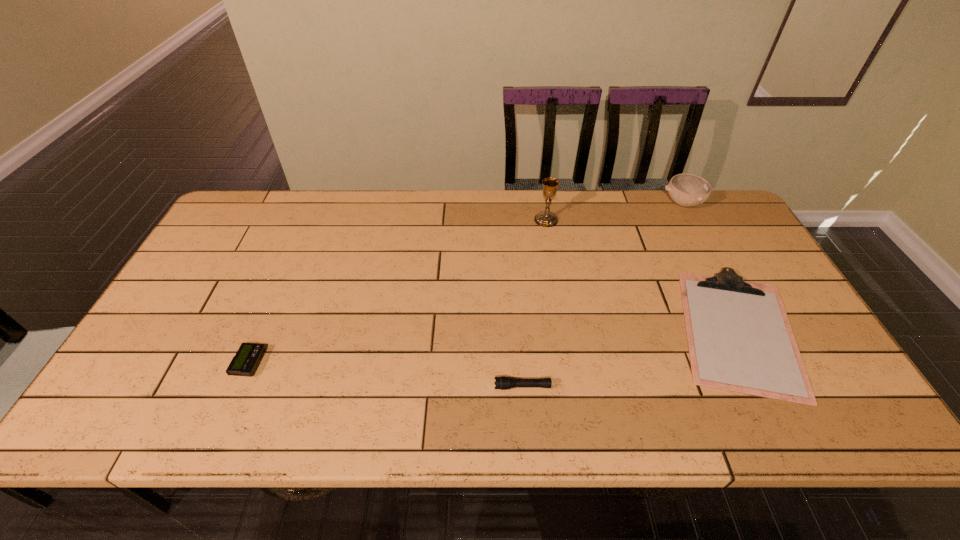
You are a GUI agent. You are given a task and a screenshot of the screen. Output one action in this format:
    pyautogui.click(x=<x>, y=<y>)
    Task: Click on the tallest object
    The height and width of the screenshot is (540, 960).
    Given the screenshot: What is the action you would take?
    pyautogui.click(x=546, y=218)

Identify the location of the third object from right to left. This screenshot has height=540, width=960. (546, 218).

Image resolution: width=960 pixels, height=540 pixels. What are the coordinates of `the second tallest object` in the screenshot? It's located at [687, 190].

The width and height of the screenshot is (960, 540). Identify the location of flashlight. (503, 382).

You are a GUI agent. You are given a task and a screenshot of the screen. Output one action in this format:
    pyautogui.click(x=<x>, y=<y>)
    Task: Click on the fourth object from right to left
    
    Given the screenshot: What is the action you would take?
    pyautogui.click(x=503, y=382)

Locate an element on the screen. beeper is located at coordinates (244, 363).

You are a GUI agent. You are given a task and a screenshot of the screen. Output one action in this format:
    pyautogui.click(x=<x>, y=<y>)
    Task: Click on the clipboard
    
    Given the screenshot: What is the action you would take?
    pyautogui.click(x=739, y=337)

Image resolution: width=960 pixels, height=540 pixels. I want to click on vacant space located on the right of the chalice, so click(598, 220).

This screenshot has height=540, width=960. Find the location of `vacant space located on the left of the bowl`. vacant space located on the left of the bowl is located at coordinates (609, 204).

This screenshot has width=960, height=540. In order to click on free space located 0.100m at the lens end of the flashlight in this screenshot , I will do `click(450, 387)`.